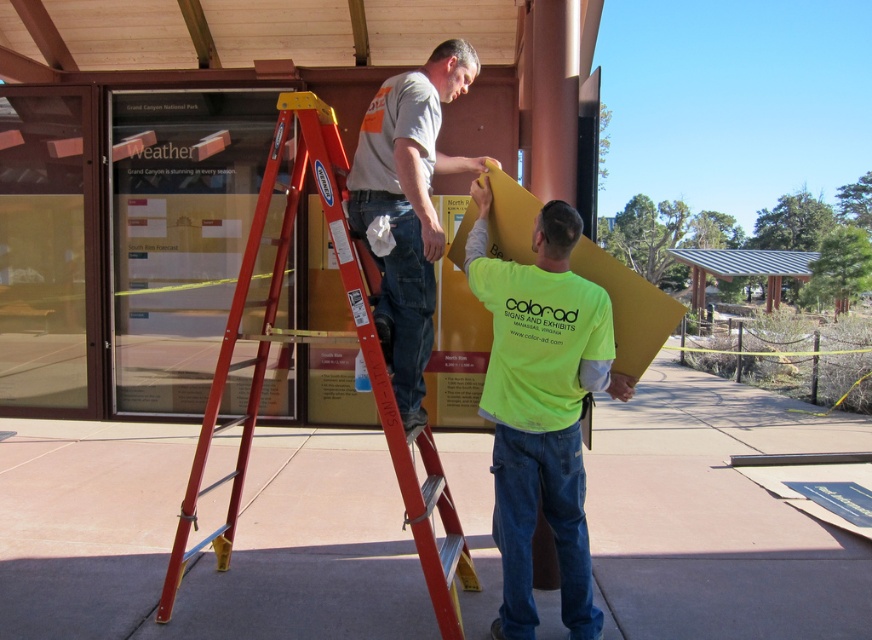
Question: Which point is farther to the camera?

Choices:
 (A) red metal ladder at center
 (B) matte gray shirt at center
 (C) neon yellow shirt at center

Answer: (A)

Question: Does neon yellow shirt at center lie behind matte gray shirt at center?

Choices:
 (A) no
 (B) yes

Answer: (B)

Question: Where is neon yellow shirt at center located in relation to red metal ladder at center in the image?

Choices:
 (A) above
 (B) below

Answer: (B)

Question: Estimate the real-world distances between objects in this image. Which object is closer to the neon yellow shirt at center?

Choices:
 (A) red metal ladder at center
 (B) matte gray shirt at center

Answer: (B)

Question: Which object appears closest to the camera in this image?

Choices:
 (A) neon yellow shirt at center
 (B) red metal ladder at center
 (C) matte gray shirt at center

Answer: (C)

Question: Is neon yellow shirt at center positioned before red metal ladder at center?

Choices:
 (A) yes
 (B) no

Answer: (A)